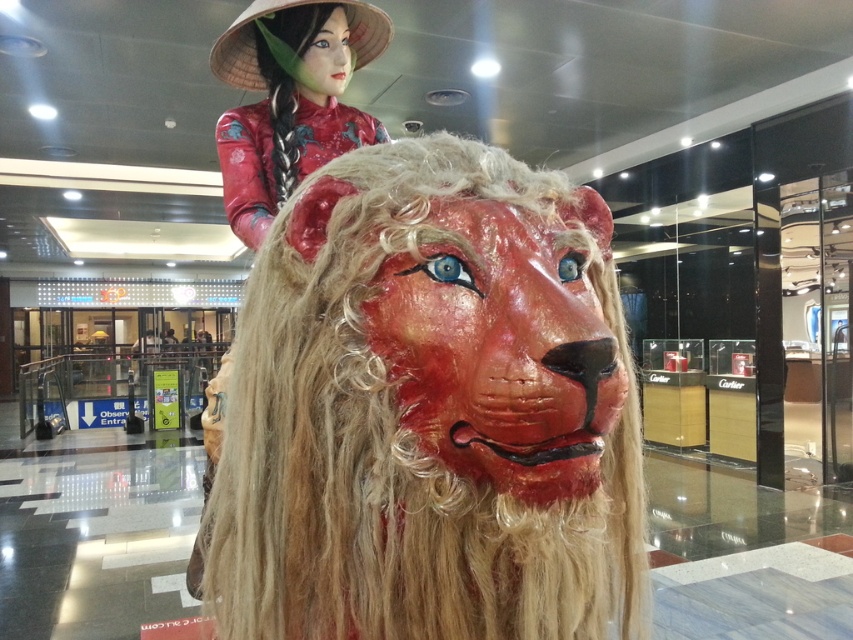
Question: Which point is closer to the camera?

Choices:
 (A) matte red lion head at center
 (B) matte red silk doll at upper center

Answer: (A)

Question: Can you confirm if matte red lion head at center is wider than matte red silk doll at upper center?

Choices:
 (A) yes
 (B) no

Answer: (A)

Question: Does matte red lion head at center have a lesser width compared to matte red silk doll at upper center?

Choices:
 (A) no
 (B) yes

Answer: (A)

Question: Does matte red lion head at center have a lesser width compared to matte red silk doll at upper center?

Choices:
 (A) no
 (B) yes

Answer: (A)

Question: Which of the following is the farthest from the observer?

Choices:
 (A) matte red lion head at center
 (B) matte red silk doll at upper center

Answer: (B)